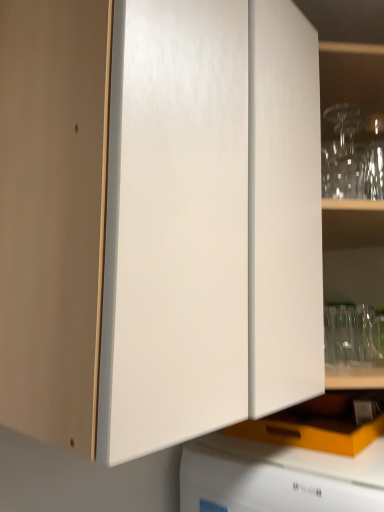
Question: Should I look upward or downward to see orange matte drawer at lower center?

Choices:
 (A) down
 (B) up

Answer: (A)